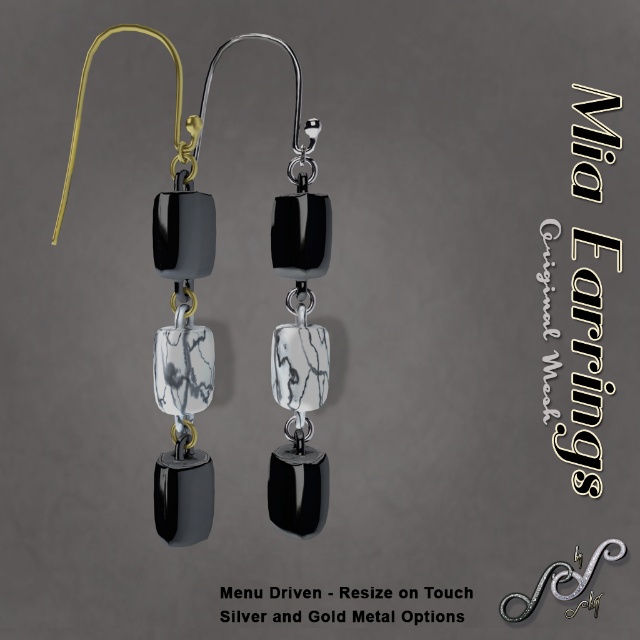
What do you see at coordinates (176, 323) in the screenshot?
I see `matte black earrings at center` at bounding box center [176, 323].

The height and width of the screenshot is (640, 640). Identify the location of matte black earrings at center. (176, 323).